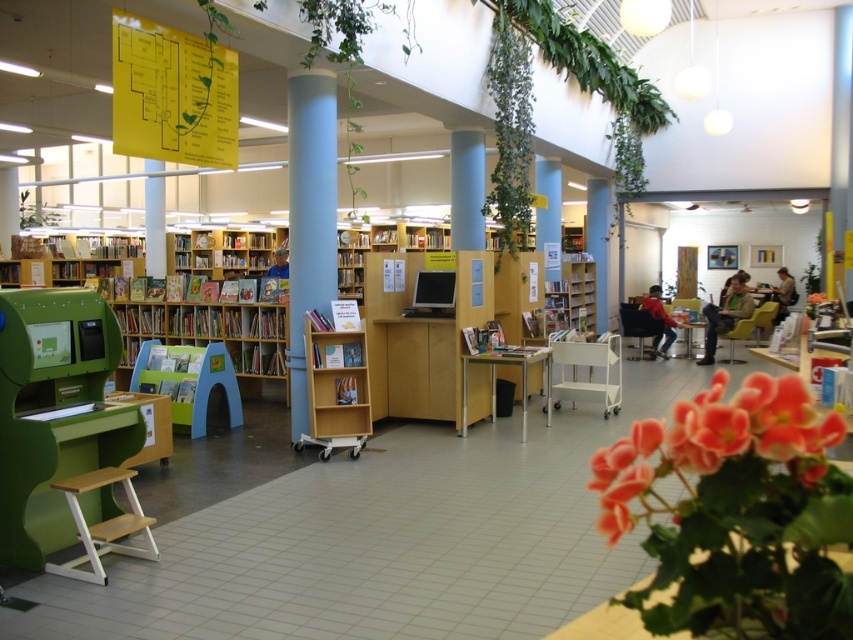
You are a librarian who needs to place a new bookshelf in the library. The bookshelf must be placed 1 meter away from the blue matte column at center. Is there enough space between the column and the large windows on the right to accommodate the bookshelf?

The blue matte column at center is located at point (309, 220). Since the exact distance between the column and the windows isn???t provided, we cannot confirm if there???s enough space for the 1 meter requirement. Additional measurements are needed.

From the picture: You are a librarian who needs to place a new book display on the white plastic cart at center. Considering the height of the cart compared to the blue smooth pillar at center, will the books placed on the cart be visible over the pillar when viewed from the entrance?

The white plastic cart at center is not as tall as the blue smooth pillar at center, so the books placed on the cart may not be fully visible over the pillar when viewed from the entrance. Consider adjusting the cart position or using a taller display stand.

Consider the image. You need to move a large box that is 1.2 meters wide through the space between the blue matte column at center and the white plastic cart at center. Based on their widths, can the box fit through the space?

The blue matte column at center is narrower than the white plastic cart at center. However, the total width of the space between them isn not provided. The question cannot be answered with the given information.